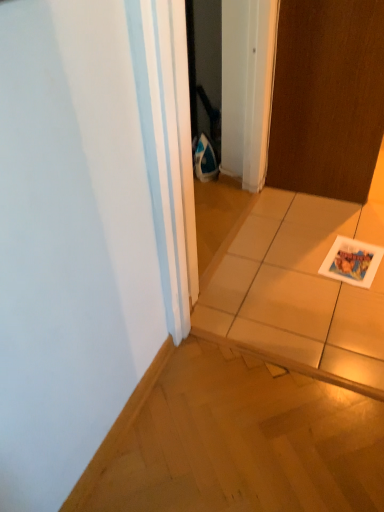
Question: Choose the correct answer: Is brown matte door at upper right inside white glossy tile at center or outside it?

Choices:
 (A) inside
 (B) outside

Answer: (B)

Question: Is brown matte door at upper right wider or thinner than white glossy tile at center?

Choices:
 (A) thin
 (B) wide

Answer: (A)

Question: Which object is positioned farthest from the brown matte door at upper right?

Choices:
 (A) white glossy postcard at lower right
 (B) white glossy tile at center

Answer: (B)

Question: Which object is the closest to the white glossy postcard at lower right?

Choices:
 (A) brown matte door at upper right
 (B) white glossy tile at center

Answer: (B)